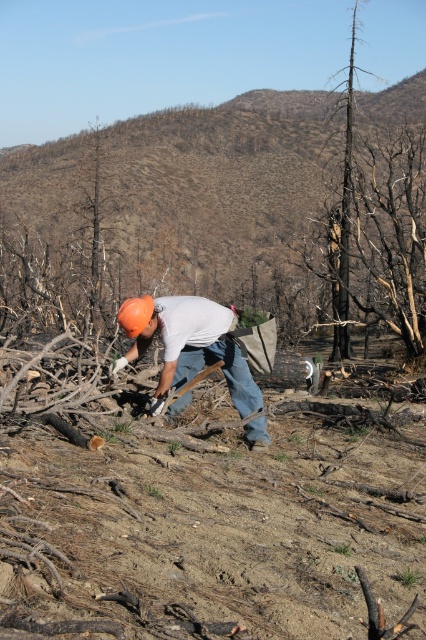
Locate an element on the screen. Image resolution: width=426 pixels, height=640 pixels. burnt wood tree at upper right is located at coordinates (342, 228).

Is point (351, 22) farther from viewer compared to point (141, 301)?

Yes, it is.

The height and width of the screenshot is (640, 426). I want to click on burnt wood tree at upper right, so pyautogui.click(x=342, y=228).

Can you confirm if burnt wood at center is smaller than orange matte helmet at center?

No.

Is the position of burnt wood at center less distant than that of orange matte helmet at center?

No, burnt wood at center is further to the viewer.

The image size is (426, 640). I want to click on burnt wood at center, so click(218, 186).

Locate an element on the screen. The image size is (426, 640). burnt wood at center is located at coordinates click(x=218, y=186).

Which of these two, burnt wood at center or burnt wood tree at upper right, stands shorter?

burnt wood at center is shorter.

Which is in front, point (330, 141) or point (344, 243)?

Point (344, 243) is in front.

What are the coordinates of `burnt wood at center` in the screenshot? It's located at (218, 186).